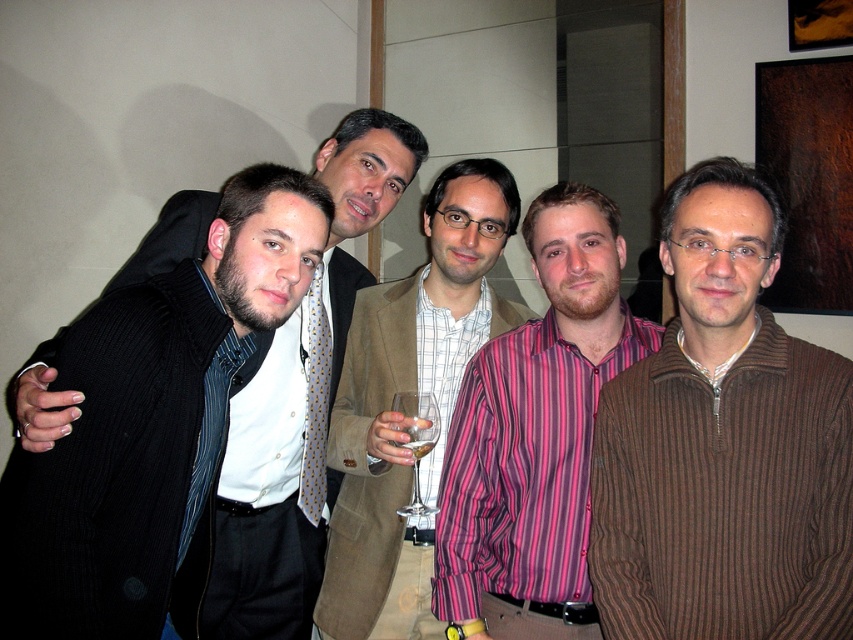
Between striped cotton shirt at center and clear glass wine glass at center, which one has less height?

clear glass wine glass at center is shorter.

Between striped cotton shirt at center and clear glass wine glass at center, which one has more height?

With more height is striped cotton shirt at center.

Is point (485, 512) positioned before point (427, 403)?

No, (485, 512) is further to viewer.

The width and height of the screenshot is (853, 640). Identify the location of striped cotton shirt at center. (537, 433).

Can you confirm if striped cotton shirt at center is wider than matte black sweater at left?

No.

Does striped cotton shirt at center appear on the left side of matte black sweater at left?

In fact, striped cotton shirt at center is to the right of matte black sweater at left.

Is point (581, 282) behind point (233, 634)?

No, it is not.

The image size is (853, 640). What are the coordinates of `striped cotton shirt at center` in the screenshot? It's located at (537, 433).

Can you confirm if light brown textured blazer at center is wider than clear glass wine glass at center?

Correct, the width of light brown textured blazer at center exceeds that of clear glass wine glass at center.

Who is more distant from viewer, (453, 212) or (430, 445)?

The point (453, 212) is more distant.

Does point (381, 452) come behind point (434, 400)?

Yes, point (381, 452) is farther from viewer.

The width and height of the screenshot is (853, 640). Identify the location of light brown textured blazer at center. (409, 381).